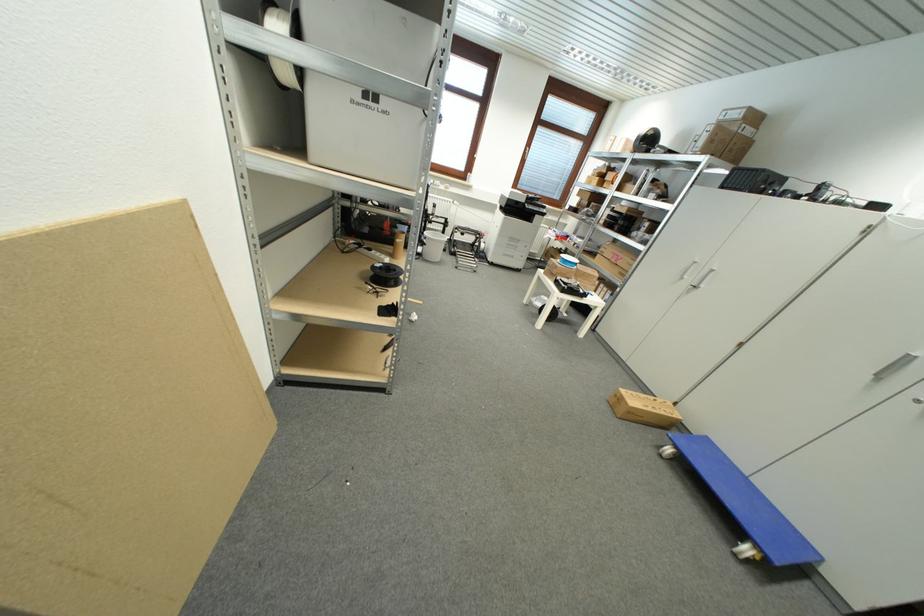
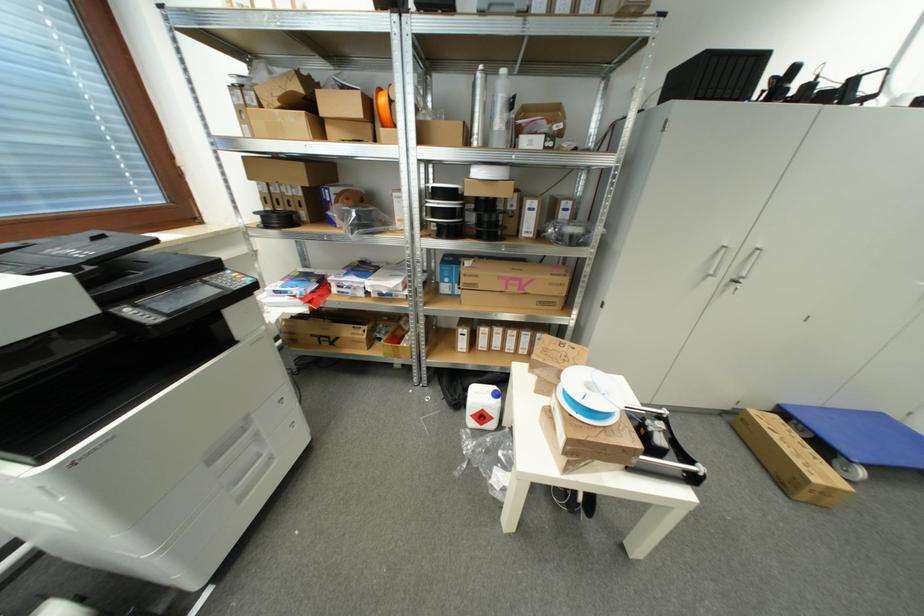
In the second image, find the point that corresponds to point (824, 561) in the first image.

(885, 418)